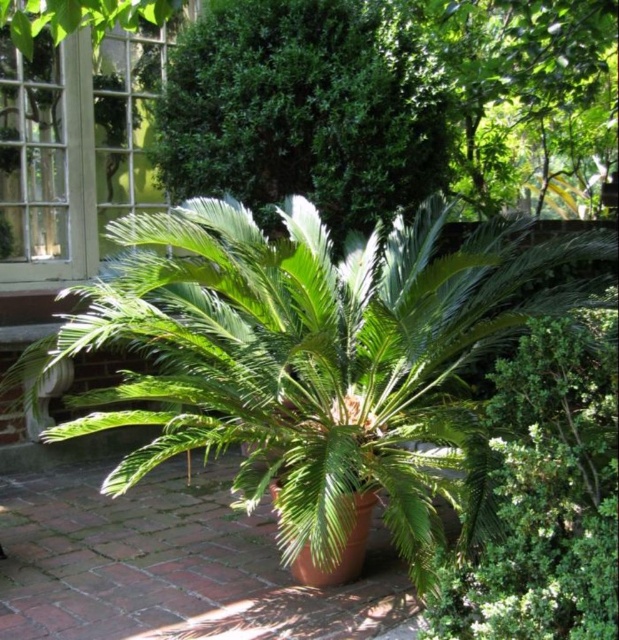
The width and height of the screenshot is (619, 640). What do you see at coordinates (310, 358) in the screenshot?
I see `green leafy palm at center` at bounding box center [310, 358].

Does point (337, 429) lie in front of point (209, 4)?

Yes, it is.

This screenshot has height=640, width=619. Describe the element at coordinates (310, 358) in the screenshot. I see `green leafy palm at center` at that location.

The width and height of the screenshot is (619, 640). I want to click on green leafy palm at center, so click(x=310, y=358).